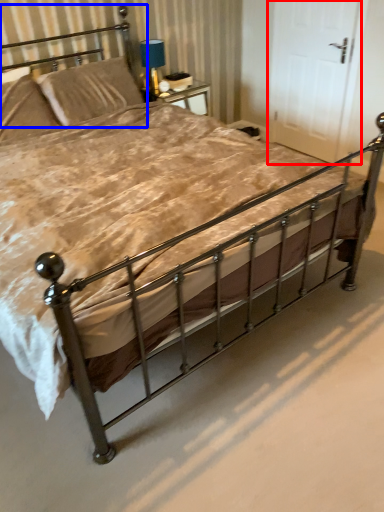
Question: Which object is further to the camera taking this photo, door (highlighted by a red box) or headboard (highlighted by a blue box)?

Choices:
 (A) door
 (B) headboard

Answer: (A)